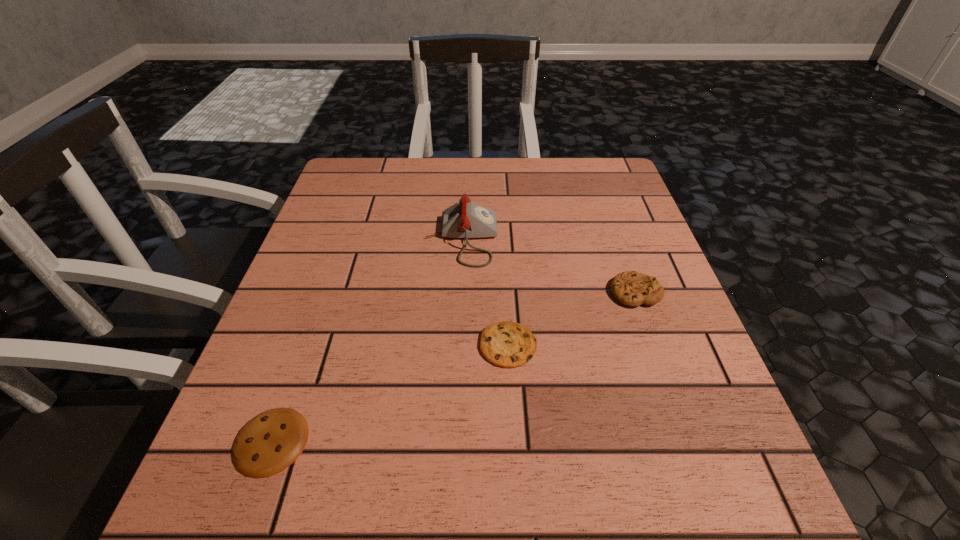
I want to click on vacant space that is in between the second farthest object and the leftmost object, so click(x=453, y=367).

The image size is (960, 540). What are the coordinates of `free spot between the tallest cookie and the second nearest object` in the screenshot? It's located at (572, 319).

Image resolution: width=960 pixels, height=540 pixels. Find the location of `free space between the third farthest object and the rightmost cookie`. free space between the third farthest object and the rightmost cookie is located at coordinates (572, 319).

Where is `vacant point located between the rightmost object and the nearest cookie`? vacant point located between the rightmost object and the nearest cookie is located at coordinates (453, 367).

I want to click on object that is the closest to the farthest cookie, so click(506, 344).

You are a GUI agent. You are given a task and a screenshot of the screen. Output one action in this format:
    pyautogui.click(x=<x>, y=<y>)
    Task: Click on the object that is the third nearest to the third farthest object
    The width and height of the screenshot is (960, 540).
    Given the screenshot: What is the action you would take?
    pyautogui.click(x=267, y=444)

Choose which cookie is the nearest neighbor to the second cookie from right to left. Please provide its 2D coordinates. Your answer should be formatted as a tuple, i.e. [(x, y)], where the tuple contains the x and y coordinates of a point satisfying the conditions above.

[(631, 288)]

Where is `the closest cookie to the rightmost object`? Image resolution: width=960 pixels, height=540 pixels. the closest cookie to the rightmost object is located at coordinates (506, 344).

Identify the location of vacant area that satisfies the following two spatial constraints: 1. on the dial of the tallest object; 2. on the front side of the nearest cookie. (452, 441).

You are a GUI agent. You are given a task and a screenshot of the screen. Output one action in this format:
    pyautogui.click(x=<x>, y=<y>)
    Task: Click on the free location that satisfies the following two spatial constraints: 1. on the back side of the farthest cookie; 2. on the right side of the third farthest object
    The height and width of the screenshot is (540, 960).
    Given the screenshot: What is the action you would take?
    pyautogui.click(x=505, y=292)